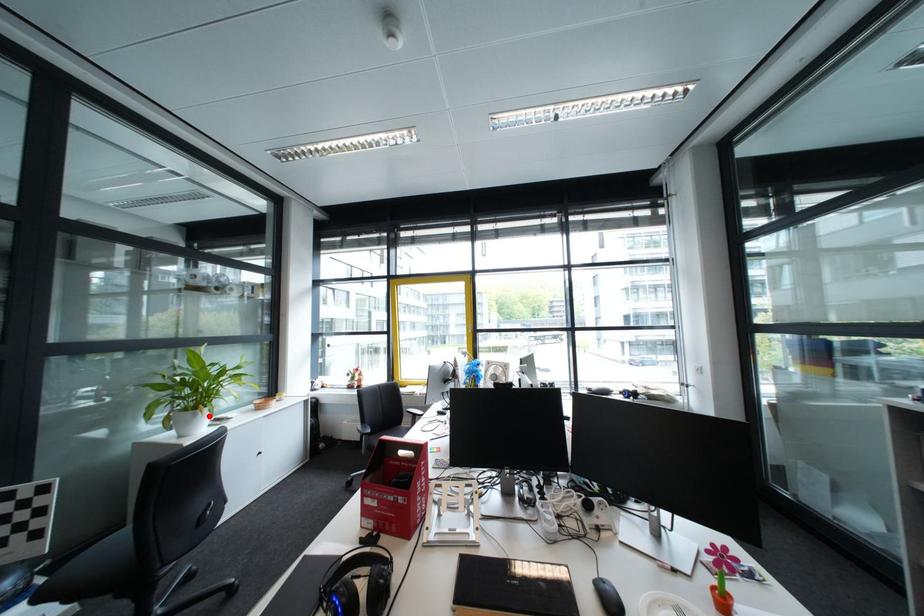
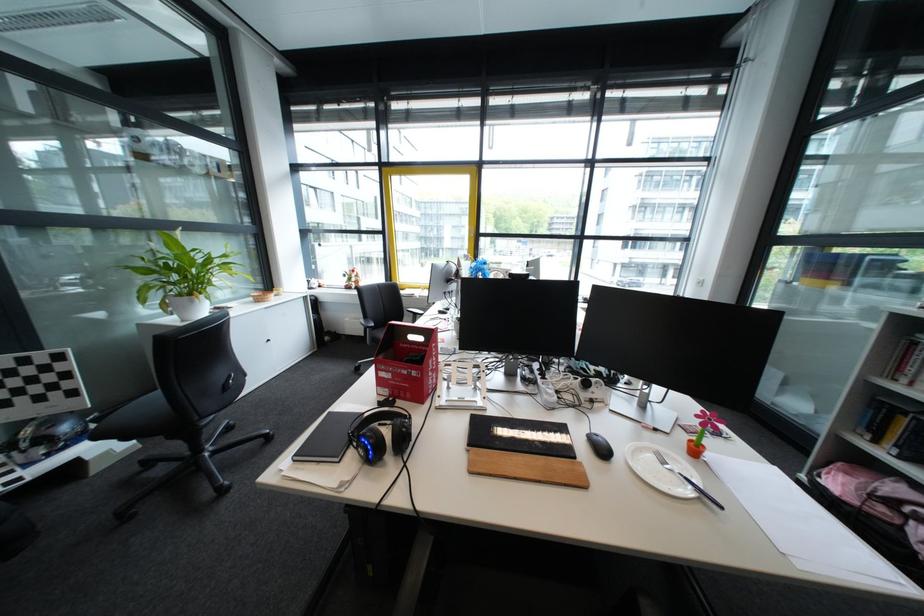
Question: I am providing you with two images of the same scene from different viewpoints. Image1 has a red point marked. In image2, the corresponding 3D location appears at what relative position? Reply with the corresponding letter.

Choices:
 (A) Closer
 (B) Farther

Answer: (A)